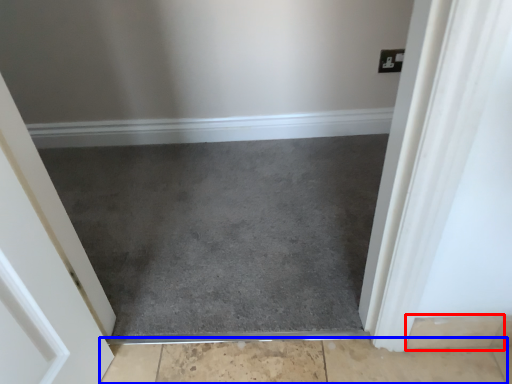
Question: Which point is closer to the camera, concrete (highlighted by a red box) or concrete (highlighted by a blue box)?

Choices:
 (A) concrete
 (B) concrete

Answer: (A)